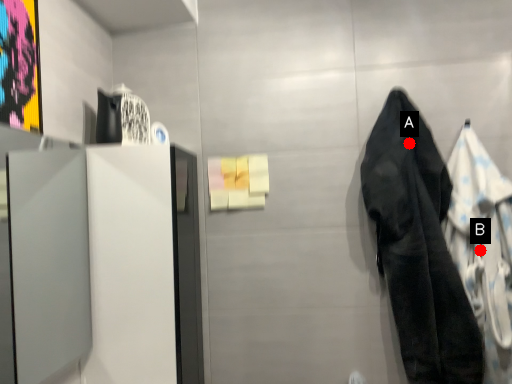
Question: Two points are circled on the image, labeled by A and B beside each circle. Which point is farther to the camera?

Choices:
 (A) A is further
 (B) B is further

Answer: (A)